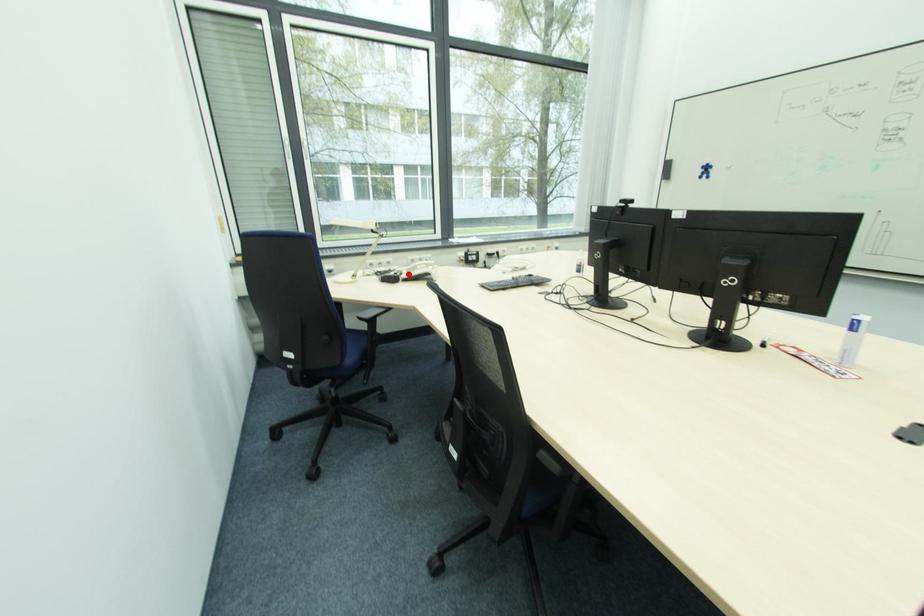
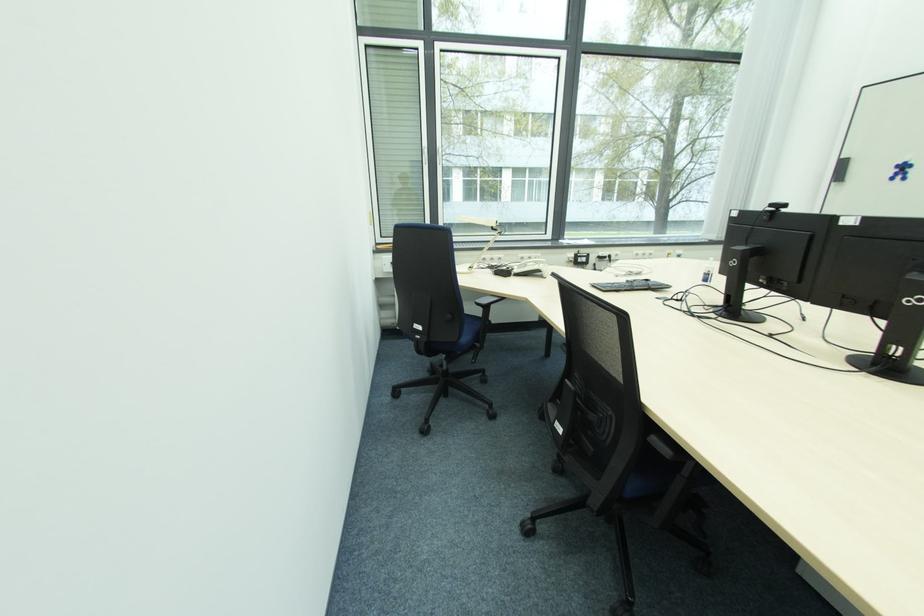
Question: I am providing you with two images of the same scene from different viewpoints. In image1, a red point is highlighted. Considering the same 3D point in image2, which of the following is correct?

Choices:
 (A) It is closer
 (B) It is farther

Answer: (A)